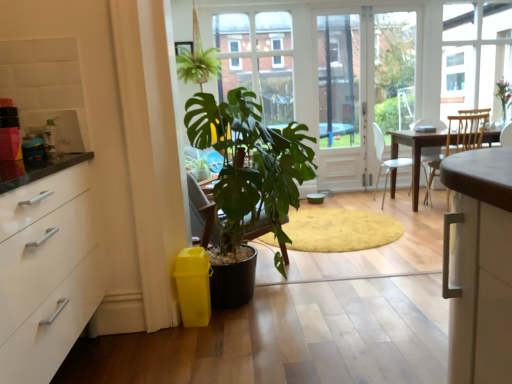
Question: Considering the relative sizes of transparent glass screen door at center and green leafy plant at center in the image provided, is transparent glass screen door at center taller than green leafy plant at center?

Choices:
 (A) yes
 (B) no

Answer: (A)

Question: Is transparent glass screen door at center looking in the opposite direction of green leafy plant at center?

Choices:
 (A) yes
 (B) no

Answer: (B)

Question: Considering the relative sizes of transparent glass screen door at center and green leafy plant at center in the image provided, is transparent glass screen door at center smaller than green leafy plant at center?

Choices:
 (A) yes
 (B) no

Answer: (A)

Question: From the image's perspective, would you say transparent glass screen door at center is shown under green leafy plant at center?

Choices:
 (A) yes
 (B) no

Answer: (A)

Question: Is the position of transparent glass screen door at center less distant than that of green leafy plant at center?

Choices:
 (A) yes
 (B) no

Answer: (B)

Question: Considering the positions of metallic silver kettle at upper left and white plastic chair at center in the image, is metallic silver kettle at upper left wider or thinner than white plastic chair at center?

Choices:
 (A) thin
 (B) wide

Answer: (A)

Question: From a real-world perspective, is metallic silver kettle at upper left physically located above or below white plastic chair at center?

Choices:
 (A) below
 (B) above

Answer: (B)

Question: From the image's perspective, is metallic silver kettle at upper left located above or below white plastic chair at center?

Choices:
 (A) below
 (B) above

Answer: (A)

Question: In the image, is metallic silver kettle at upper left on the left side or the right side of white plastic chair at center?

Choices:
 (A) right
 (B) left

Answer: (B)

Question: Considering the relative positions of green matte plant at center and metallic silver kettle at upper left in the image provided, is green matte plant at center to the left or to the right of metallic silver kettle at upper left?

Choices:
 (A) left
 (B) right

Answer: (B)

Question: In terms of height, does green matte plant at center look taller or shorter compared to metallic silver kettle at upper left?

Choices:
 (A) tall
 (B) short

Answer: (A)

Question: Is point 263,155 closer or farther from the camera than point 58,142?

Choices:
 (A) closer
 (B) farther

Answer: (B)

Question: From the image's perspective, relative to metallic silver kettle at upper left, is green matte plant at center above or below?

Choices:
 (A) above
 (B) below

Answer: (B)

Question: From the image's perspective, is metallic silver kettle at upper left located above or below transparent glass screen door at center?

Choices:
 (A) above
 (B) below

Answer: (B)

Question: Considering the positions of metallic silver kettle at upper left and transparent glass screen door at center in the image, is metallic silver kettle at upper left wider or thinner than transparent glass screen door at center?

Choices:
 (A) wide
 (B) thin

Answer: (B)